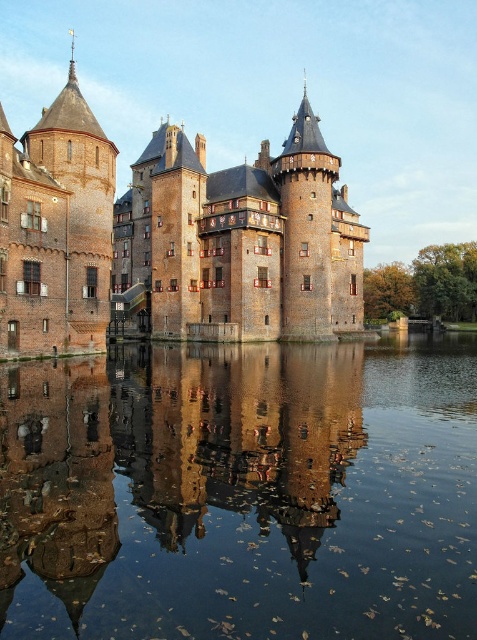
Which of these two, smooth reflective water at center or brick stone castle at center, stands shorter?

Standing shorter between the two is smooth reflective water at center.

Who is more forward, (262, 556) or (50, 289)?

Point (262, 556) is more forward.

I want to click on smooth reflective water at center, so (x=241, y=492).

The image size is (477, 640). I want to click on brick stone castle at center, so click(172, 237).

At what (x,y) coordinates should I click in order to perform the action: click on brick stone castle at center. Please return your answer as a coordinate pair (x, y). The image size is (477, 640). Looking at the image, I should click on (172, 237).

Who is higher up, brick stone castle at center or smooth brown water at center?

brick stone castle at center is higher up.

Is brick stone castle at center below smooth brown water at center?

Actually, brick stone castle at center is above smooth brown water at center.

Which is behind, point (0, 170) or point (352, 368)?

Point (352, 368)

The width and height of the screenshot is (477, 640). I want to click on brick stone castle at center, so click(172, 237).